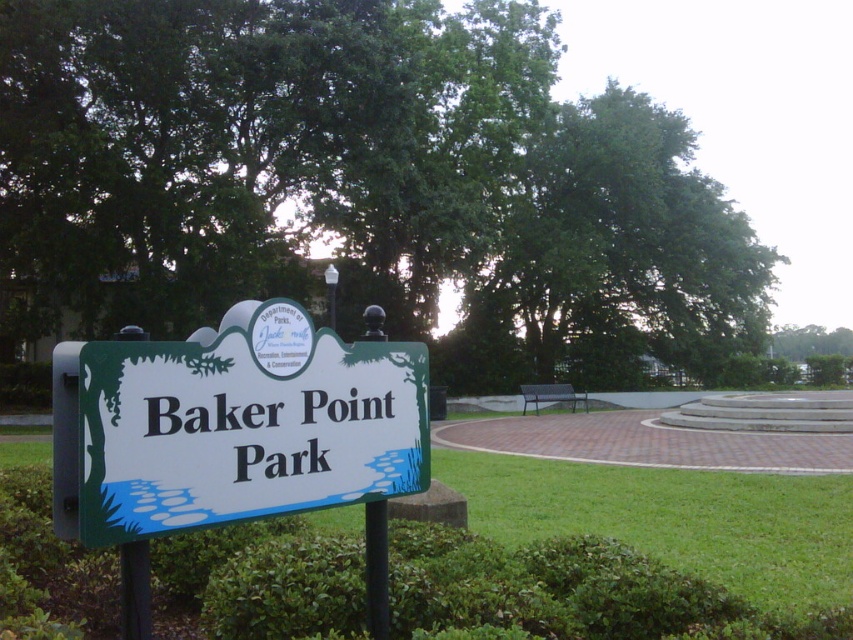
Does green leafy tree at center appear under green plastic sign at center?

No.

Does green leafy tree at center appear on the right side of green plastic sign at center?

Correct, you'll find green leafy tree at center to the right of green plastic sign at center.

Where is `green leafy tree at center`? The image size is (853, 640). green leafy tree at center is located at coordinates (363, 186).

This screenshot has height=640, width=853. I want to click on green leafy tree at center, so click(x=363, y=186).